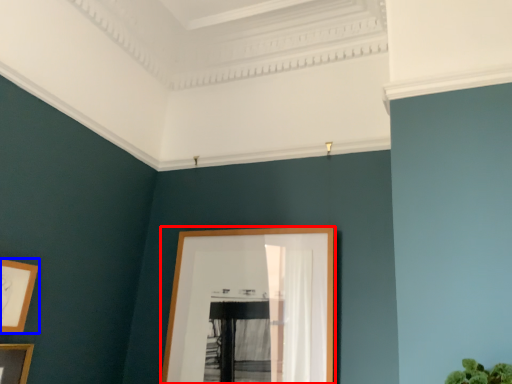
Question: Which of the following is the closest to the observer, picture frame (highlighted by a red box) or picture frame (highlighted by a blue box)?

Choices:
 (A) picture frame
 (B) picture frame

Answer: (B)